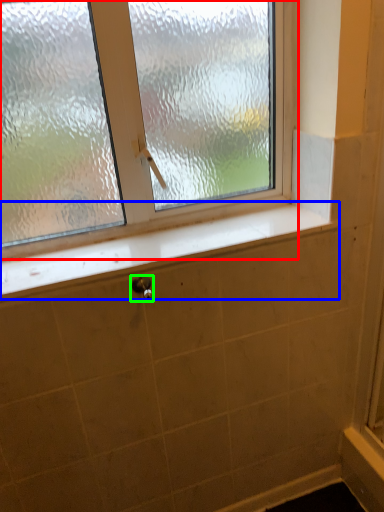
Question: Estimate the real-world distances between objects in this image. Which object is farther from window (highlighted by a red box), window sill (highlighted by a blue box) or shower (highlighted by a green box)?

Choices:
 (A) window sill
 (B) shower

Answer: (B)